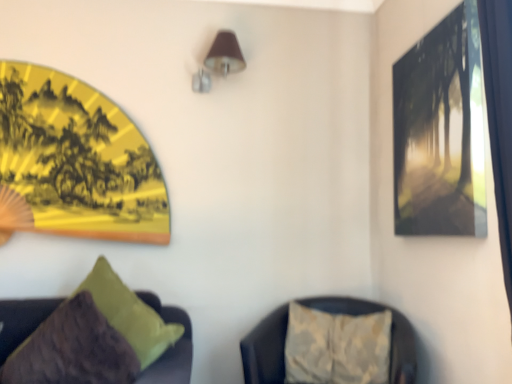
The height and width of the screenshot is (384, 512). Describe the element at coordinates (93, 337) in the screenshot. I see `velvet green pillow at lower left, which is the 1th furniture in left-to-right order` at that location.

Measure the distance between brown fabric lampshade at upper center and camera.

The depth of brown fabric lampshade at upper center is 1.99 meters.

The width and height of the screenshot is (512, 384). What do you see at coordinates (225, 54) in the screenshot? I see `brown fabric lampshade at upper center` at bounding box center [225, 54].

Identify the location of velvet green pillow at lower left, which is the 1th furniture in left-to-right order. The height and width of the screenshot is (384, 512). (93, 337).

Is velvet green pillow at lower left, the second furniture when ordered from right to left, outside of yellow paper fan at upper left, placed as the 2th picture frame when sorted from right to left?

Answer: Absolutely, velvet green pillow at lower left, the second furniture when ordered from right to left, is external to yellow paper fan at upper left, placed as the 2th picture frame when sorted from right to left.

Is velvet green pillow at lower left, which is the 1th furniture in left-to-right order, bigger than yellow paper fan at upper left, placed as the 2th picture frame when sorted from right to left?

Yes.

Which is behind, point (46, 333) or point (6, 88)?

Point (6, 88)

From a real-world perspective, which is physically below, textured beige cushion at lower right, marked as the 2th furniture in a left-to-right arrangement, or matte black picture frame at upper right, positioned as the 2th picture frame in left-to-right order?

textured beige cushion at lower right, marked as the 2th furniture in a left-to-right arrangement, is physically lower.

Can you confirm if textured beige cushion at lower right, marked as the 2th furniture in a left-to-right arrangement, is smaller than matte black picture frame at upper right, the first picture frame viewed from the right?

No.

Based on the photo, what's the angular difference between textured beige cushion at lower right, the 1th furniture positioned from the right, and matte black picture frame at upper right, positioned as the 2th picture frame in left-to-right order,'s facing directions?

The angle between the facing direction of textured beige cushion at lower right, the 1th furniture positioned from the right, and the facing direction of matte black picture frame at upper right, positioned as the 2th picture frame in left-to-right order, is 63.2 degrees.

Is textured beige cushion at lower right, the 1th furniture positioned from the right, outside of matte black picture frame at upper right, the first picture frame viewed from the right?

textured beige cushion at lower right, the 1th furniture positioned from the right, is positioned outside matte black picture frame at upper right, the first picture frame viewed from the right.

Which is correct: brown fabric lampshade at upper center is inside velvet green pillow at lower left, the second furniture when ordered from right to left, or outside of it?

brown fabric lampshade at upper center is not enclosed by velvet green pillow at lower left, the second furniture when ordered from right to left.

Considering the sizes of objects brown fabric lampshade at upper center and velvet green pillow at lower left, the second furniture when ordered from right to left, in the image provided, who is bigger, brown fabric lampshade at upper center or velvet green pillow at lower left, the second furniture when ordered from right to left,?

velvet green pillow at lower left, the second furniture when ordered from right to left, is bigger.

Locate an element on the screen. This screenshot has height=384, width=512. the 1st furniture positioned below the brown fabric lampshade at upper center (from a real-world perspective) is located at coordinates (93, 337).

From the image's perspective, is brown fabric lampshade at upper center located above or below velvet green pillow at lower left, which is the 1th furniture in left-to-right order?

Clearly, from the image's perspective, brown fabric lampshade at upper center is above velvet green pillow at lower left, which is the 1th furniture in left-to-right order.

Would you say brown fabric lampshade at upper center is part of yellow paper fan at upper left, placed as the 2th picture frame when sorted from right to left,'s contents?

Actually, brown fabric lampshade at upper center is outside yellow paper fan at upper left, placed as the 2th picture frame when sorted from right to left.

This screenshot has height=384, width=512. I want to click on the 2nd picture frame below when counting from the brown fabric lampshade at upper center (from the image's perspective), so click(74, 162).

In the scene shown: Can you confirm if yellow paper fan at upper left, acting as the second picture frame starting from the front, is bigger than brown fabric lampshade at upper center?

Yes, yellow paper fan at upper left, acting as the second picture frame starting from the front, is bigger than brown fabric lampshade at upper center.

Is yellow paper fan at upper left, which appears as the first picture frame when viewed from the back, in front of brown fabric lampshade at upper center?

Yes, yellow paper fan at upper left, which appears as the first picture frame when viewed from the back, is closer to the camera.

Identify the location of lamp that appears on the right of velvet green pillow at lower left, which is the 1th furniture in left-to-right order. (225, 54).

How many degrees apart are the facing directions of velvet green pillow at lower left, which is the 1th furniture in left-to-right order, and brown fabric lampshade at upper center?

19.5 degrees.

Could you measure the distance between velvet green pillow at lower left, the second furniture when ordered from right to left, and brown fabric lampshade at upper center?

They are 3.87 feet apart.

Relative to velvet green pillow at lower left, the second furniture when ordered from right to left, is matte black picture frame at upper right, positioned as the 2th picture frame in left-to-right order, in front or behind?

matte black picture frame at upper right, positioned as the 2th picture frame in left-to-right order, is behind velvet green pillow at lower left, the second furniture when ordered from right to left.

Between matte black picture frame at upper right, positioned as the 2th picture frame in left-to-right order, and velvet green pillow at lower left, which is the 1th furniture in left-to-right order, which one has less height?

velvet green pillow at lower left, which is the 1th furniture in left-to-right order, is shorter.

What's the angular difference between matte black picture frame at upper right, positioned as the 1th picture frame in front-to-back order, and velvet green pillow at lower left, which is the 1th furniture in left-to-right order,'s facing directions?

70.4 degrees separate the facing orientations of matte black picture frame at upper right, positioned as the 1th picture frame in front-to-back order, and velvet green pillow at lower left, which is the 1th furniture in left-to-right order.

This screenshot has height=384, width=512. Find the location of `furniture in front of the matte black picture frame at upper right, positioned as the 1th picture frame in front-to-back order`. furniture in front of the matte black picture frame at upper right, positioned as the 1th picture frame in front-to-back order is located at coordinates (93, 337).

Which object is wider, velvet green pillow at lower left, which is the 1th furniture in left-to-right order, or matte black picture frame at upper right, which is counted as the second picture frame, starting from the back?

With larger width is velvet green pillow at lower left, which is the 1th furniture in left-to-right order.

Is velvet green pillow at lower left, which is the 1th furniture in left-to-right order, positioned with its back to matte black picture frame at upper right, positioned as the 1th picture frame in front-to-back order?

No.

From the picture: Is velvet green pillow at lower left, which is the 1th furniture in left-to-right order, at the left side of matte black picture frame at upper right, positioned as the 1th picture frame in front-to-back order?

Correct, you'll find velvet green pillow at lower left, which is the 1th furniture in left-to-right order, to the left of matte black picture frame at upper right, positioned as the 1th picture frame in front-to-back order.

From a real-world perspective, count 1st picture frames upward from the velvet green pillow at lower left, which is the 1th furniture in left-to-right order, and point to it. Please provide its 2D coordinates.

[(74, 162)]

The width and height of the screenshot is (512, 384). Find the location of `furniture behind the matte black picture frame at upper right, the first picture frame viewed from the right`. furniture behind the matte black picture frame at upper right, the first picture frame viewed from the right is located at coordinates (391, 332).

When comparing their distances from velvet green pillow at lower left, which is the 1th furniture in left-to-right order, does textured beige cushion at lower right, the 1th furniture positioned from the right, or matte black picture frame at upper right, which is counted as the second picture frame, starting from the back, seem closer?

textured beige cushion at lower right, the 1th furniture positioned from the right.

Looking at the image, which one is located further to yellow paper fan at upper left, acting as the second picture frame starting from the front, textured beige cushion at lower right, the 1th furniture positioned from the right, or matte black picture frame at upper right, which is counted as the second picture frame, starting from the back?

matte black picture frame at upper right, which is counted as the second picture frame, starting from the back, lies further to yellow paper fan at upper left, acting as the second picture frame starting from the front, than the other object.

When comparing their distances from velvet green pillow at lower left, which is the 1th furniture in left-to-right order, does matte black picture frame at upper right, which is counted as the second picture frame, starting from the back, or brown fabric lampshade at upper center seem closer?

brown fabric lampshade at upper center is closer to velvet green pillow at lower left, which is the 1th furniture in left-to-right order.

Looking at the image, which one is located further to brown fabric lampshade at upper center, yellow paper fan at upper left, acting as the second picture frame starting from the front, or velvet green pillow at lower left, the second furniture when ordered from right to left?

velvet green pillow at lower left, the second furniture when ordered from right to left, is positioned further to the anchor brown fabric lampshade at upper center.

Estimate the real-world distances between objects in this image. Which object is closer to brown fabric lampshade at upper center, matte black picture frame at upper right, which is counted as the second picture frame, starting from the back, or velvet green pillow at lower left, which is the 1th furniture in left-to-right order?

matte black picture frame at upper right, which is counted as the second picture frame, starting from the back, is closer to brown fabric lampshade at upper center.

Considering their positions, is matte black picture frame at upper right, positioned as the 1th picture frame in front-to-back order, positioned closer to velvet green pillow at lower left, which is the 1th furniture in left-to-right order, than yellow paper fan at upper left, acting as the 1th picture frame starting from the left?

Based on the image, yellow paper fan at upper left, acting as the 1th picture frame starting from the left, appears to be nearer to velvet green pillow at lower left, which is the 1th furniture in left-to-right order.

Considering their positions, is brown fabric lampshade at upper center positioned closer to matte black picture frame at upper right, positioned as the 2th picture frame in left-to-right order, than yellow paper fan at upper left, acting as the second picture frame starting from the front?

The object closer to matte black picture frame at upper right, positioned as the 2th picture frame in left-to-right order, is brown fabric lampshade at upper center.

In the scene shown: From the image, which object appears to be nearer to textured beige cushion at lower right, marked as the 2th furniture in a left-to-right arrangement, velvet green pillow at lower left, the second furniture when ordered from right to left, or yellow paper fan at upper left, placed as the 2th picture frame when sorted from right to left?

Based on the image, velvet green pillow at lower left, the second furniture when ordered from right to left, appears to be nearer to textured beige cushion at lower right, marked as the 2th furniture in a left-to-right arrangement.

Where is `furniture between brown fabric lampshade at upper center and textured beige cushion at lower right, marked as the 2th furniture in a left-to-right arrangement, from top to bottom`? The width and height of the screenshot is (512, 384). furniture between brown fabric lampshade at upper center and textured beige cushion at lower right, marked as the 2th furniture in a left-to-right arrangement, from top to bottom is located at coordinates (93, 337).

You are a GUI agent. You are given a task and a screenshot of the screen. Output one action in this format:
    pyautogui.click(x=<x>, y=<y>)
    Task: Click on the furniture between velvet green pillow at lower left, the second furniture when ordered from right to left, and matte black picture frame at upper right, which is counted as the second picture frame, starting from the back, from left to right
    
    Given the screenshot: What is the action you would take?
    pyautogui.click(x=391, y=332)

What are the coordinates of `lamp situated between velvet green pillow at lower left, which is the 1th furniture in left-to-right order, and matte black picture frame at upper right, the first picture frame viewed from the right, from left to right` in the screenshot? It's located at (225, 54).

Locate an element on the screen. The image size is (512, 384). furniture between yellow paper fan at upper left, which appears as the first picture frame when viewed from the back, and textured beige cushion at lower right, the 1th furniture positioned from the right, from left to right is located at coordinates pyautogui.click(x=93, y=337).